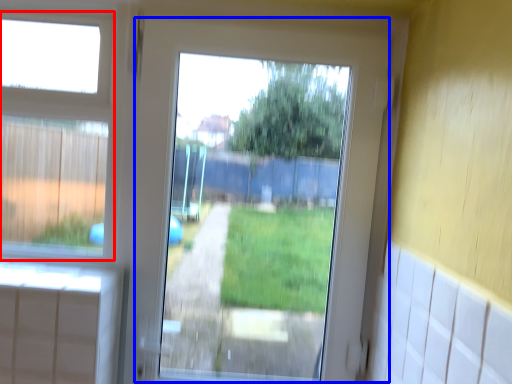
Question: Which object appears closest to the camera in this image, bay window (highlighted by a red box) or screen door (highlighted by a blue box)?

Choices:
 (A) bay window
 (B) screen door

Answer: (B)